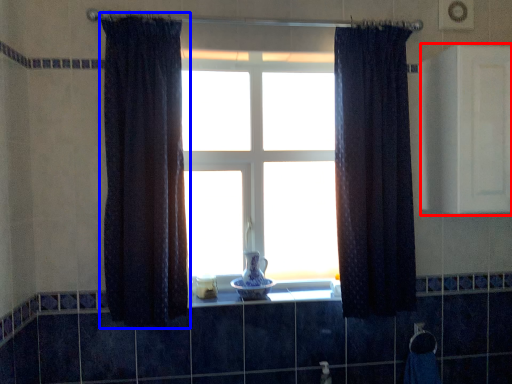
Question: Which point is closer to the camera, medicine cabinet (highlighted by a red box) or curtain (highlighted by a blue box)?

Choices:
 (A) medicine cabinet
 (B) curtain

Answer: (B)